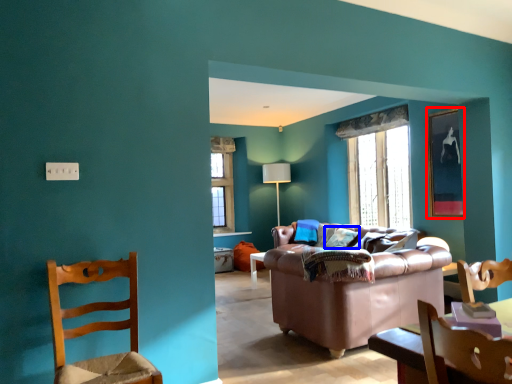
Question: Which object is further to the camera taking this photo, picture frame (highlighted by a red box) or pillow (highlighted by a blue box)?

Choices:
 (A) picture frame
 (B) pillow

Answer: (B)